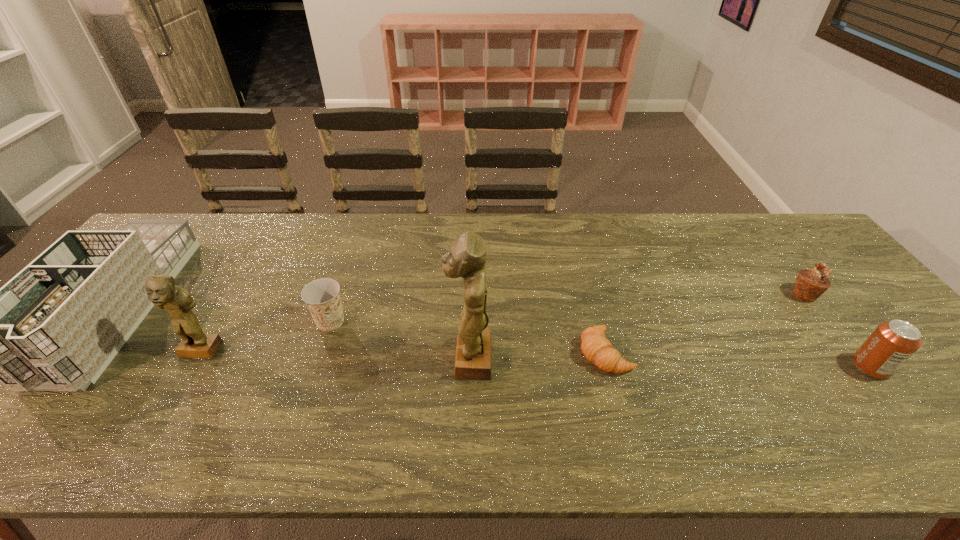
Identify the location of figurine situated at the near edge. (467, 258).

Locate an element on the screen. This screenshot has height=540, width=960. dollhouse located in the near edge section of the desktop is located at coordinates (55, 326).

Where is `object present at the left edge`? object present at the left edge is located at coordinates tap(55, 326).

Locate an element on the screen. The width and height of the screenshot is (960, 540). can that is positioned at the right edge is located at coordinates (x=892, y=343).

Locate an element on the screen. The height and width of the screenshot is (540, 960). muffin located in the right edge section of the desktop is located at coordinates (809, 285).

Identify the location of object located in the far left corner section of the desktop. (55, 326).

This screenshot has width=960, height=540. In order to click on object that is at the near left corner in this screenshot , I will do `click(55, 326)`.

The image size is (960, 540). In the image, there is a desktop. Find the location of `vacant space at the far edge`. vacant space at the far edge is located at coordinates (264, 216).

In the image, there is a desktop. Where is `vacant region at the near edge`? vacant region at the near edge is located at coordinates (158, 397).

Image resolution: width=960 pixels, height=540 pixels. In the image, there is a desktop. What are the coordinates of `free space at the far right corner` in the screenshot? It's located at (778, 253).